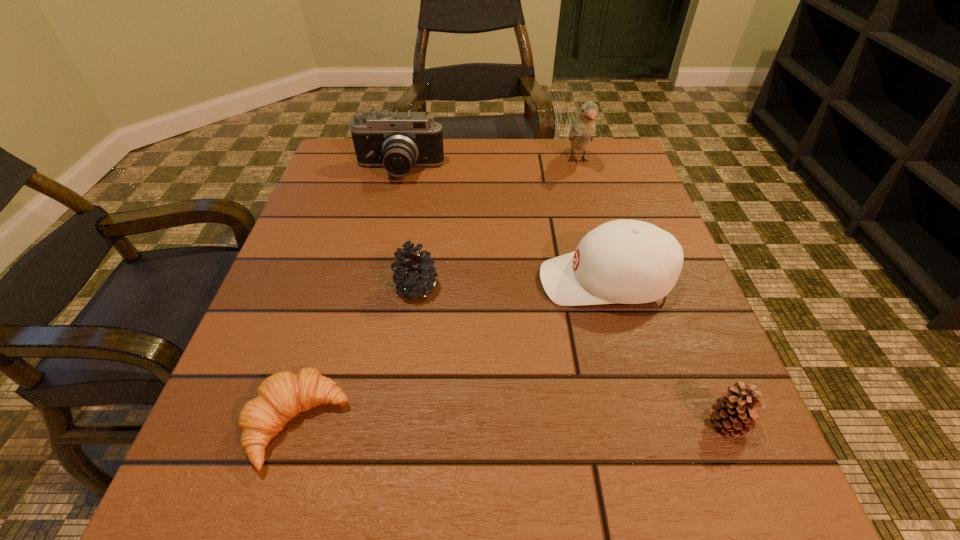
You are a GUI agent. You are given a task and a screenshot of the screen. Output one action in this format:
    pyautogui.click(x=<x>, y=<y>)
    Task: Click on the free space that is in between the camera and the bird
    
    Given the screenshot: What is the action you would take?
    pyautogui.click(x=489, y=166)

Identify which object is the fifth closest to the shorter pinecone. Please provide its 2D coordinates. Your answer should be formatted as a tuple, i.e. [(x, y)], where the tuple contains the x and y coordinates of a point satisfying the conditions above.

[(397, 141)]

Select which object is the fourth closest to the nearer pinecone. Please provide its 2D coordinates. Your answer should be formatted as a tuple, i.e. [(x, y)], where the tuple contains the x and y coordinates of a point satisfying the conditions above.

[(583, 130)]

Find the location of a particular element. The image size is (960, 540). free space that satisfies the following two spatial constraints: 1. at the face of the shorter pinecone; 2. on the right side of the tallest object is located at coordinates (653, 424).

Locate an element on the screen. The height and width of the screenshot is (540, 960). vacant position in the image that satisfies the following two spatial constraints: 1. on the front-facing side of the baseball cap; 2. on the front side of the crescent roll is located at coordinates (643, 424).

Locate an element on the screen. The image size is (960, 540). free location that satisfies the following two spatial constraints: 1. at the face of the tallest object; 2. on the front-facing side of the baseball cap is located at coordinates (612, 281).